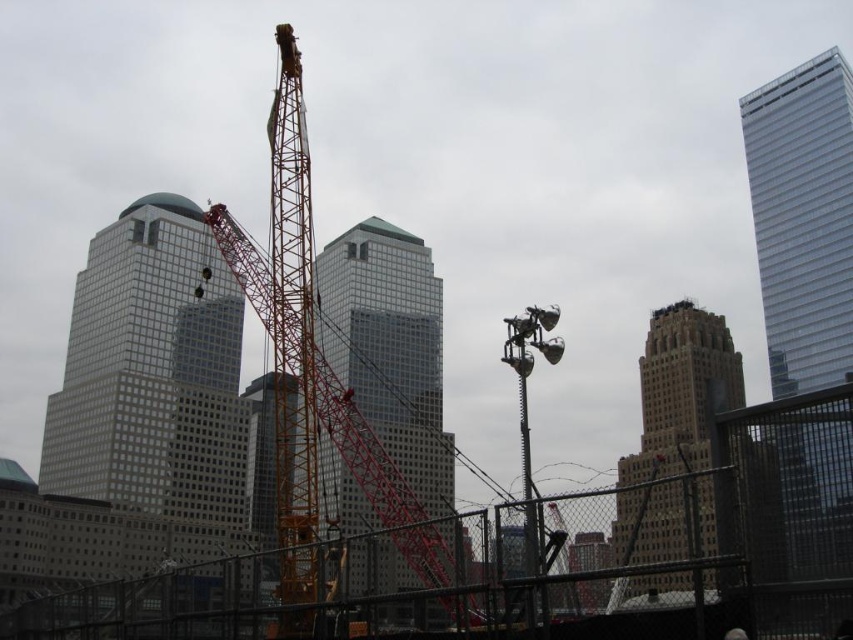
You are an architect observing the construction site. You notice the matte glass skyscraper at left and the clear glass skyscraper at upper right. Which one is located lower in the image?

The matte glass skyscraper at left is positioned under the clear glass skyscraper at upper right, so it is lower in the image.